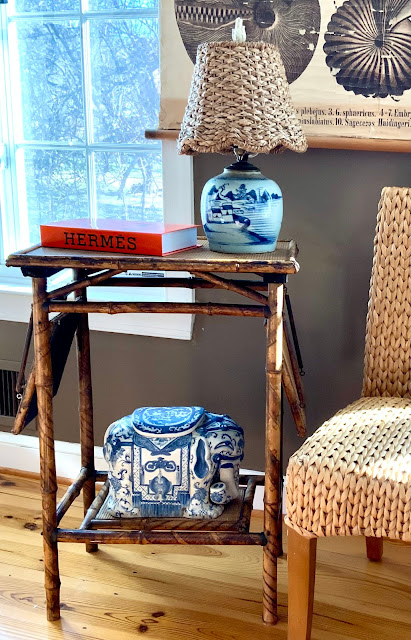
Where is `window`? The height and width of the screenshot is (640, 411). window is located at coordinates (133, 115).